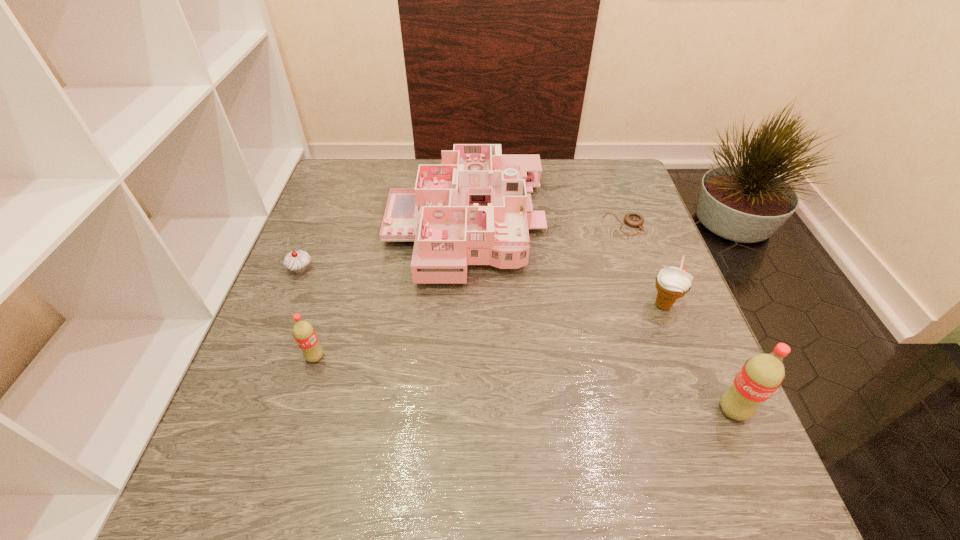
Locate an element on the screen. pocket watch that is positioned at the right edge is located at coordinates (632, 219).

Locate an element on the screen. icecream that is at the right edge is located at coordinates (672, 283).

Locate an element on the screen. This screenshot has height=540, width=960. object that is at the near right corner is located at coordinates 761,375.

I want to click on free space at the far edge of the desktop, so click(x=553, y=192).

Where is `vacant position at the left edge of the desktop`? vacant position at the left edge of the desktop is located at coordinates (294, 277).

Find the location of `free location at the right edge`. free location at the right edge is located at coordinates (651, 233).

The image size is (960, 540). In the image, there is a desktop. In order to click on vacant area at the far left corner in this screenshot , I will do `click(374, 175)`.

Image resolution: width=960 pixels, height=540 pixels. I want to click on vacant space at the near left corner, so click(x=259, y=437).

The width and height of the screenshot is (960, 540). In order to click on free point between the nearer soda and the third nearest object in this screenshot , I will do `click(698, 358)`.

The image size is (960, 540). In order to click on free spot between the icecream and the nearer soda in this screenshot , I will do `click(698, 358)`.